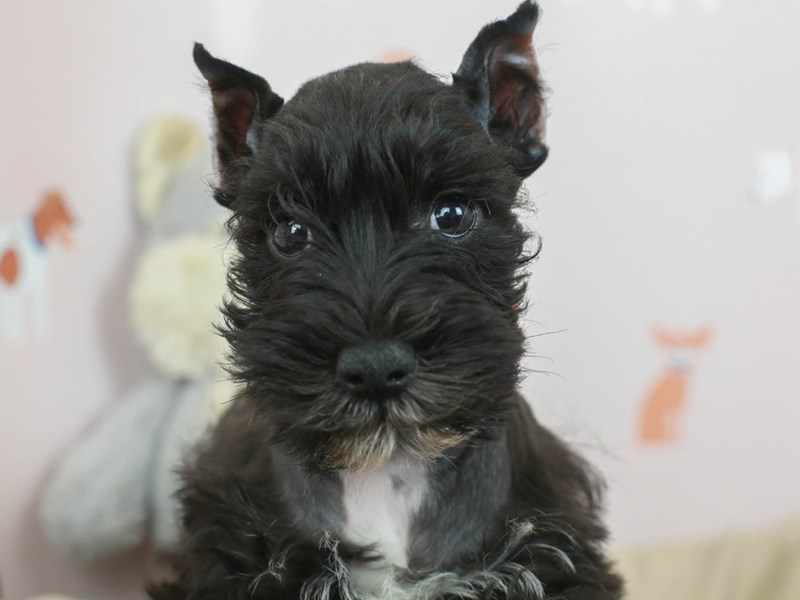
Where is `white fur`? The width and height of the screenshot is (800, 600). white fur is located at coordinates (390, 515).